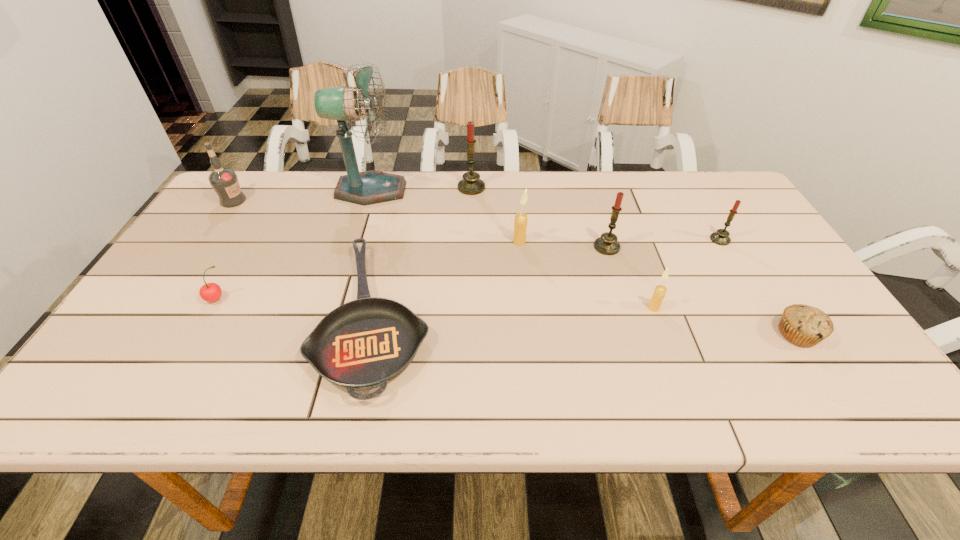
The image size is (960, 540). I want to click on free space that satisfies the following two spatial constraints: 1. on the back side of the frying pan; 2. on the front label of the leftmost object, so click(x=401, y=200).

Image resolution: width=960 pixels, height=540 pixels. In order to click on free point that satisfies the following two spatial constraints: 1. in front of the muffin where the wind blows; 2. on the left side of the fan in this screenshot , I will do `click(326, 334)`.

The image size is (960, 540). In order to click on free location that satisfies the following two spatial constraints: 1. on the front side of the fourth candle from right to left; 2. on the right side of the nearest candle in this screenshot , I will do `click(526, 308)`.

Locate an element on the screen. The width and height of the screenshot is (960, 540). vacant space that satisfies the following two spatial constraints: 1. in front of the fan where the wind blows; 2. on the back side of the rightmost candle is located at coordinates pos(356,240).